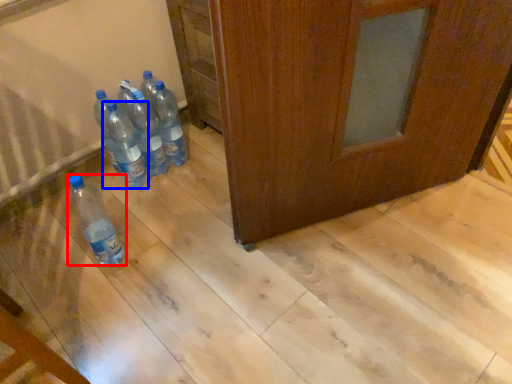
Question: Which of the following is the farthest to the observer, bottle (highlighted by a red box) or bottle (highlighted by a blue box)?

Choices:
 (A) bottle
 (B) bottle

Answer: (B)